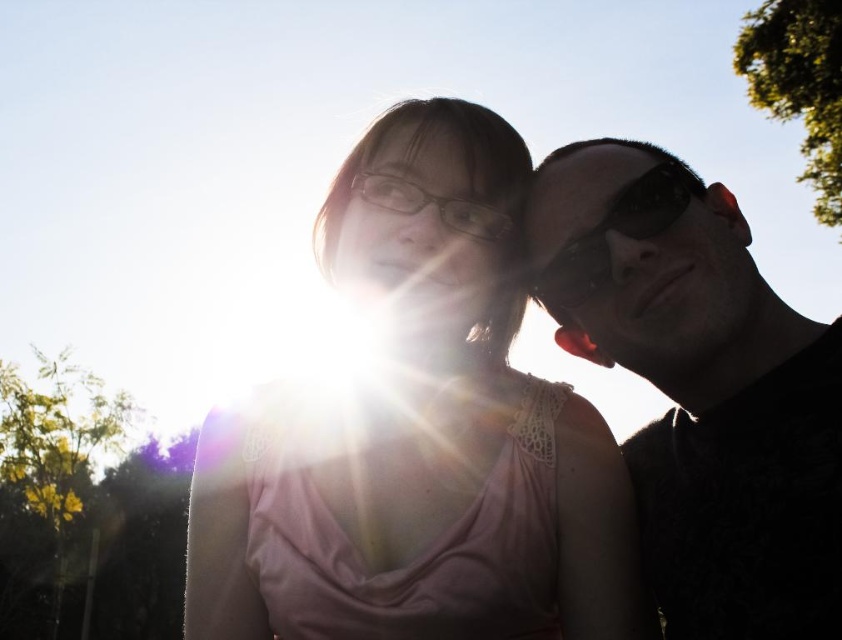
Question: Can you confirm if pink lace tank top at center is positioned to the left of black matte sunglasses at right?

Choices:
 (A) yes
 (B) no

Answer: (A)

Question: Estimate the real-world distances between objects in this image. Which object is closer to the pink lace tank top at center?

Choices:
 (A) black reflective sunglasses at right
 (B) black matte sunglasses at right

Answer: (B)

Question: Which of these objects is positioned farthest from the black reflective sunglasses at right?

Choices:
 (A) pink lace tank top at center
 (B) black matte sunglasses at right

Answer: (A)

Question: Which of the following is the farthest from the observer?

Choices:
 (A) (653, 259)
 (B) (568, 273)
 (C) (440, 620)

Answer: (B)

Question: Can you confirm if black matte sunglasses at right is smaller than black reflective sunglasses at right?

Choices:
 (A) no
 (B) yes

Answer: (A)

Question: In this image, where is black matte sunglasses at right located relative to black reflective sunglasses at right?

Choices:
 (A) above
 (B) below

Answer: (B)